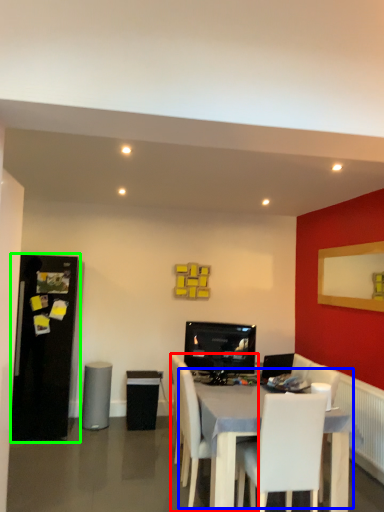
Question: Which object is positioned farthest from chair (highlighted by a red box)? Select from table (highlighted by a blue box) and fridge (highlighted by a green box).

Choices:
 (A) table
 (B) fridge

Answer: (B)